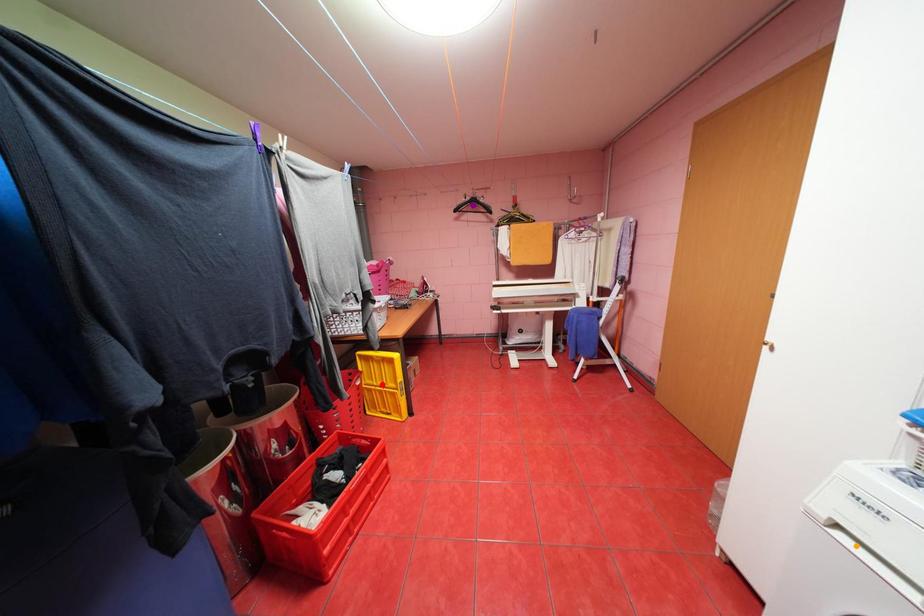
Order these from nearest to farthest:
A) red point
B) purple point
C) orange point

1. orange point
2. red point
3. purple point